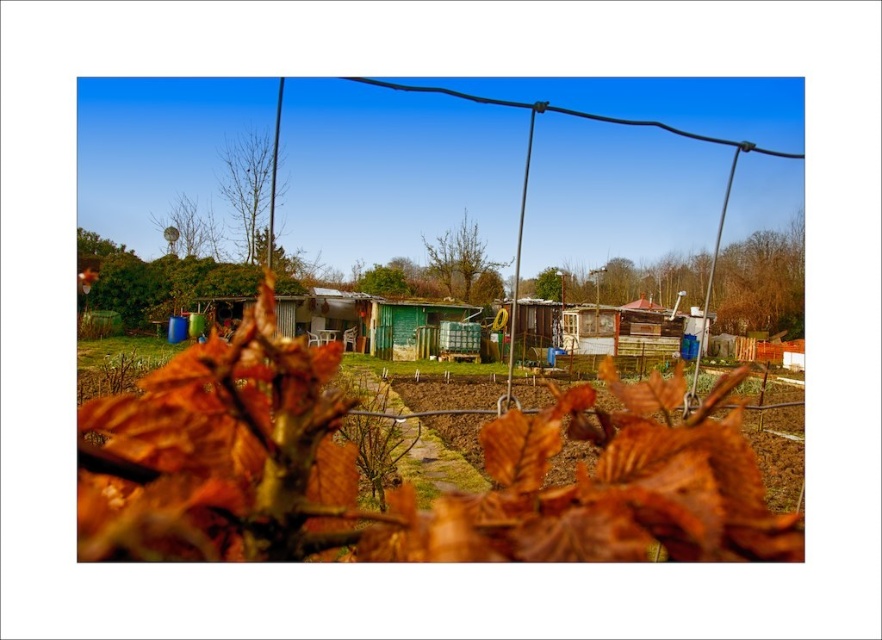
You are a landscape architect planning to install a new pathway between the brown wooden fence at center and the bare branches at upper center. The pathway requires a minimum of 30 meters of space to accommodate a gentle slope. Based on the scene, is the available distance sufficient?

The distance between the brown wooden fence at center and the bare branches at upper center is 28.75 meters. Since the required minimum space is 30 meters, the available distance is insufficient for the pathway.

You are a gardener who needs to install a new satellite dish. You have a small satellite dish that is the same size as the green matte satellite dish at upper center. The brown wooden fence at center is blocking your view. Can you place your new dish somewhere else to avoid the fence?

The brown wooden fence at center is larger in size than the green matte satellite dish at upper center. Since the fence is larger, it might block the view. You can place your new dish somewhere else, like near the green matte satellite dish at upper center, to avoid the fence.

In the scene shown: You are standing at the origin point of the image. Which direction should you move to reach the brown wooden fence at center?

The brown wooden fence at center is located at coordinate point 0.444 on the x axis and 0.864 on the y axis. Since you are at the origin point, you should move towards the right and upwards to reach it.